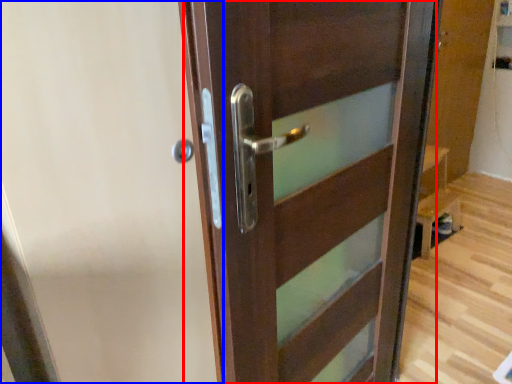
Question: Among these objects, which one is farthest to the camera, door (highlighted by a red box) or screen door (highlighted by a blue box)?

Choices:
 (A) door
 (B) screen door

Answer: (B)